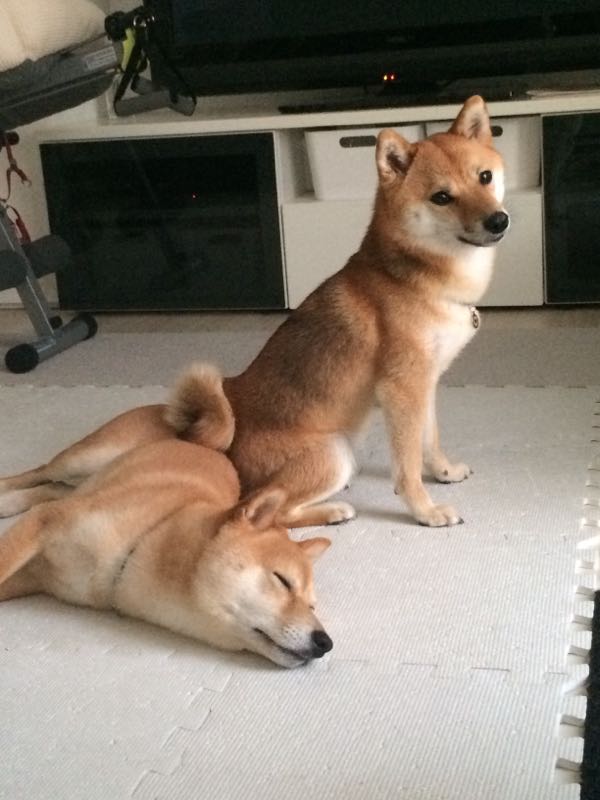
Where is `wastebasket`? This screenshot has height=800, width=600. wastebasket is located at coordinates (337, 156), (525, 161).